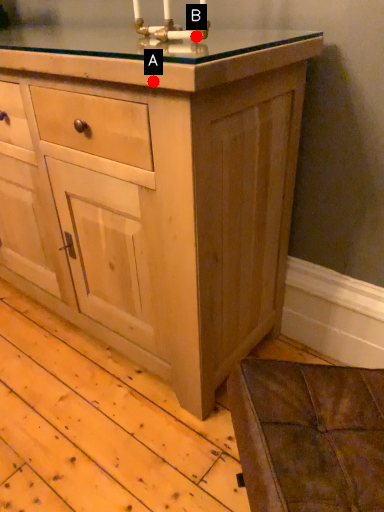
Question: Two points are circled on the image, labeled by A and B beside each circle. Which of the following is the closest to the observer?

Choices:
 (A) A is closer
 (B) B is closer

Answer: (A)